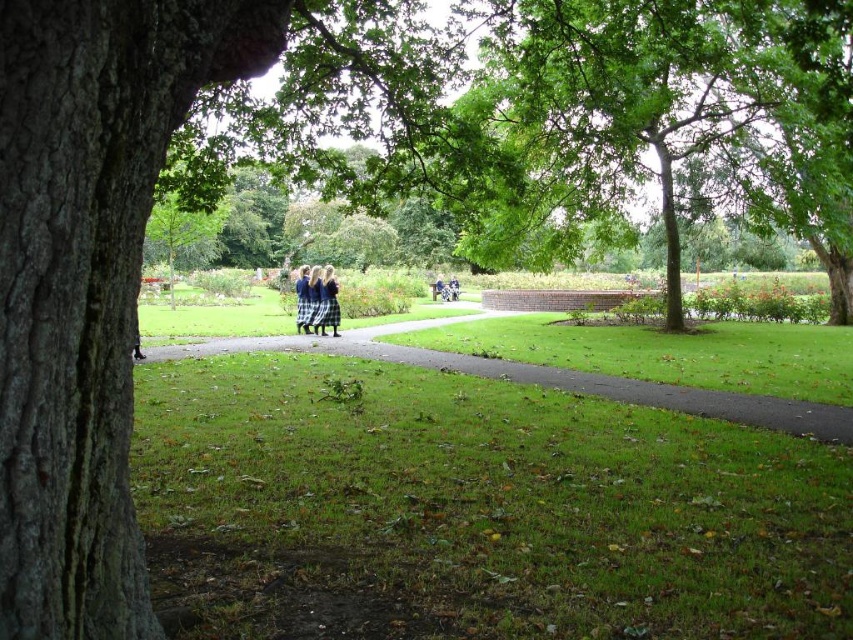
You are a photographer setting up a shoot in the park. You notice the silk blue dress at center and the dark blue skirt at center in your frame. Which object should you adjust to ensure both are fully visible in the photo?

The silk blue dress at center is positioned under the dark blue skirt at center, so you should adjust the dark blue skirt at center to move it upwards or the silk blue dress at center to move it downwards to ensure both are fully visible in the photo.

You are standing at the entrance of the park and want to reach the green grass at center. Based on the image, in which direction should you walk relative to the tree on the left?

The green grass at center is located at coordinates 0.591 on the x axis and 0.640 on the y axis. Since the tree is on the left side of the image, you should walk towards the right to reach the green grass at center.